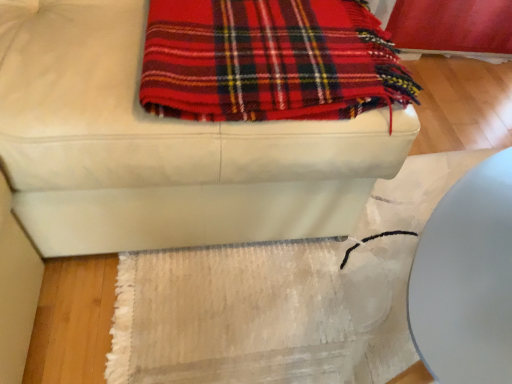
Question: Is red plaid blanket at upper center a part of white textured mat at lower center?

Choices:
 (A) yes
 (B) no

Answer: (B)

Question: Is white textured mat at lower center looking in the opposite direction of red plaid blanket at upper center?

Choices:
 (A) no
 (B) yes

Answer: (A)

Question: From a real-world perspective, is white textured mat at lower center positioned under red plaid blanket at upper center based on gravity?

Choices:
 (A) yes
 (B) no

Answer: (A)

Question: Is white textured mat at lower center not within red plaid blanket at upper center?

Choices:
 (A) no
 (B) yes

Answer: (B)

Question: Is white textured mat at lower center closer to camera compared to red plaid blanket at upper center?

Choices:
 (A) yes
 (B) no

Answer: (A)

Question: Looking at the image, does white textured mat at lower center seem bigger or smaller compared to red plaid blanket at upper center?

Choices:
 (A) big
 (B) small

Answer: (A)

Question: From the image's perspective, is white textured mat at lower center positioned above or below red plaid blanket at upper center?

Choices:
 (A) below
 (B) above

Answer: (A)

Question: In terms of width, does white textured mat at lower center look wider or thinner when compared to red plaid blanket at upper center?

Choices:
 (A) thin
 (B) wide

Answer: (B)

Question: From a real-world perspective, relative to red plaid blanket at upper center, is white textured mat at lower center vertically above or below?

Choices:
 (A) above
 (B) below

Answer: (B)

Question: Is white leather ottoman at upper center inside the boundaries of white textured mat at lower center, or outside?

Choices:
 (A) inside
 (B) outside

Answer: (B)

Question: Is white leather ottoman at upper center wider or thinner than white textured mat at lower center?

Choices:
 (A) wide
 (B) thin

Answer: (A)

Question: Is white leather ottoman at upper center to the left or to the right of white textured mat at lower center in the image?

Choices:
 (A) left
 (B) right

Answer: (A)

Question: In terms of height, does white leather ottoman at upper center look taller or shorter compared to white textured mat at lower center?

Choices:
 (A) short
 (B) tall

Answer: (B)

Question: Which is correct: white textured mat at lower center is inside white leather ottoman at upper center, or outside of it?

Choices:
 (A) outside
 (B) inside

Answer: (A)

Question: From a real-world perspective, relative to white leather ottoman at upper center, is white textured mat at lower center vertically above or below?

Choices:
 (A) below
 (B) above

Answer: (A)